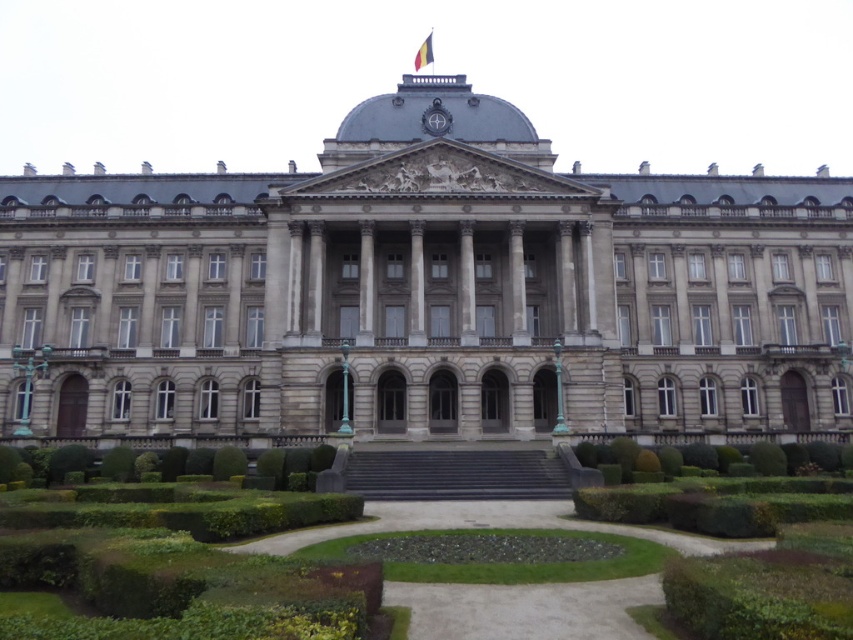
Question: Is gray stone palace at center behind green leafy bush at center?

Choices:
 (A) no
 (B) yes

Answer: (B)

Question: Which object is closer to the camera taking this photo?

Choices:
 (A) gray stone palace at center
 (B) green leafy bush at center

Answer: (B)

Question: Where is gray stone palace at center located in relation to green leafy bush at center in the image?

Choices:
 (A) above
 (B) below

Answer: (A)

Question: Which of the following is the closest to the observer?

Choices:
 (A) (213, 456)
 (B) (294, 272)

Answer: (A)

Question: Can you confirm if gray stone palace at center is positioned to the left of green leafy bush at center?

Choices:
 (A) yes
 (B) no

Answer: (B)